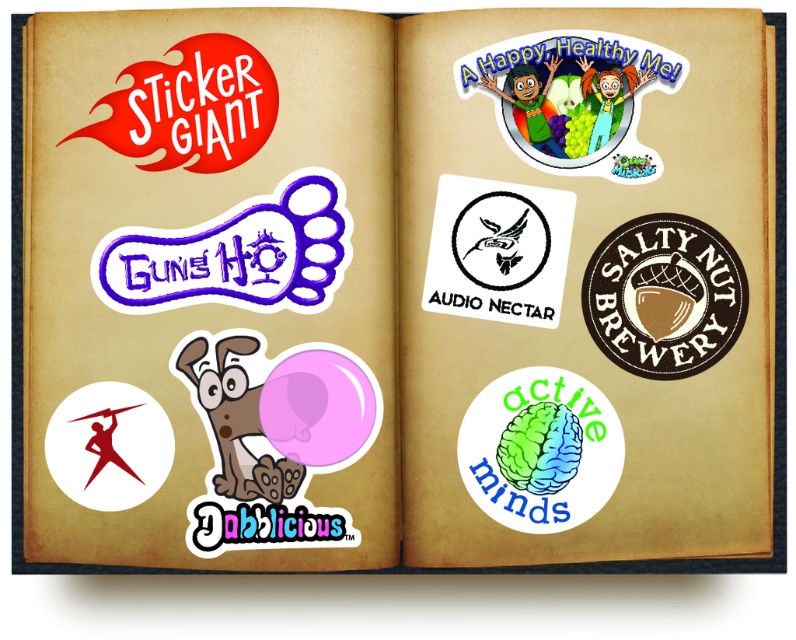
Does purple glossy foot at center-left lie in front of rainbow matte brain at center?

No, it is not.

Which is above, purple glossy foot at center-left or rainbow matte brain at center?

purple glossy foot at center-left is above.

Who is more distant from viewer, (x=242, y=221) or (x=458, y=449)?

The point (x=458, y=449) is behind.

The width and height of the screenshot is (796, 640). Identify the location of purple glossy foot at center-left. (235, 253).

Does brown textured patch at upper right have a larger size compared to red rubber stamp at upper left?

No.

At what (x,y) coordinates should I click in order to perform the action: click on brown textured patch at upper right. Please return your answer as a coordinate pair (x, y). This screenshot has width=796, height=640. Looking at the image, I should click on [x=664, y=296].

Is rainbow matte brain at center to the right of red rubber stamp at upper left from the viewer's perspective?

Indeed, rainbow matte brain at center is positioned on the right side of red rubber stamp at upper left.

Who is more forward, (599, 403) or (201, 61)?

Point (201, 61)

The height and width of the screenshot is (640, 796). I want to click on rainbow matte brain at center, so click(540, 449).